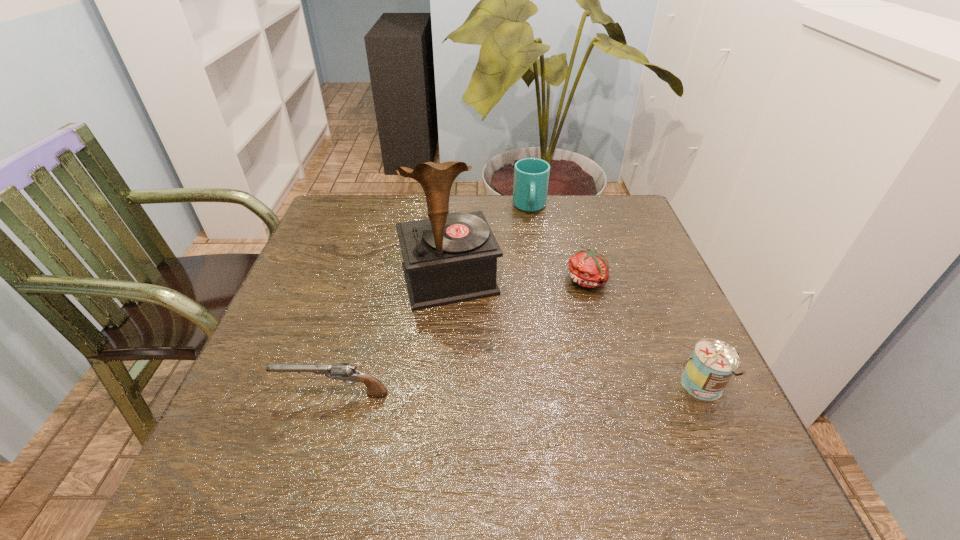
Find the location of a particular element. vacant space at the near left corner of the desktop is located at coordinates (298, 431).

Find the location of a particular element. free space at the near right corner of the desktop is located at coordinates (730, 418).

This screenshot has height=540, width=960. Find the location of `vacant space that is in between the gun and the rightmost object`. vacant space that is in between the gun and the rightmost object is located at coordinates (517, 390).

Identify the location of empty location between the can and the gun. (517, 390).

Locate an element on the screen. unoccupied area between the third object from left to right and the rightmost object is located at coordinates (615, 297).

This screenshot has height=540, width=960. I want to click on free space between the rightmost object and the tomato, so click(645, 334).

Locate an element on the screen. vacant space in between the tomato and the can is located at coordinates (645, 334).

I want to click on unoccupied area between the rightmost object and the third object from left to right, so click(615, 297).

Find the location of `free space between the rightmost object and the gun`. free space between the rightmost object and the gun is located at coordinates (517, 390).

You are a GUI agent. You are given a task and a screenshot of the screen. Output one action in this format:
    pyautogui.click(x=<x>, y=<y>)
    Task: Click on the free space between the tomato and the gun
    The height and width of the screenshot is (540, 960).
    Given the screenshot: What is the action you would take?
    pyautogui.click(x=462, y=337)